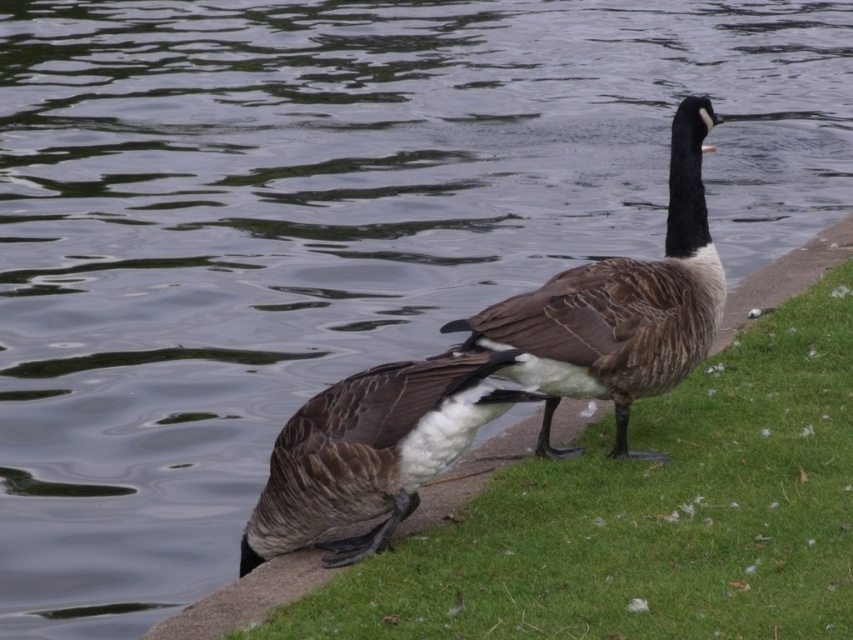
You are a photographer trying to capture a closeup of the Canada geese on the concrete edge. You are currently standing at point [428,570]. The camera you are using has a focal length of 50mm. Can you estimate if you are within the recommended 15 feet distance for a safe and ethical wildlife photography distance? Please answer based on the coordinates provided and the camera details.

The distance between point [428,570] and the camera is 14.68 feet, which is within the recommended 15 feet distance for safe and ethical wildlife photography. You can proceed with the closeup.

You are a wildlife photographer aiming to capture both the brown speckled goose at center and the brown speckled duck at center in a single frame. Given that your camera has a fixed focal length, which bird should you position closer to the center of the frame to ensure both fit within the shot?

The brown speckled goose at center is wider than the brown speckled duck at center. To ensure both fit within the shot, position the brown speckled goose at center closer to the center of the frame since its larger size requires more space.

You are a photographer trying to capture a closeup shot of the green grass at lower right. Your camera lens has a minimum focusing distance of 10 feet. Can you take the photo without moving closer?

The green grass at lower right is 12.30 feet away from the camera, which is within the minimum focusing distance of 10 feet. Therefore, you can take the photo without moving closer.